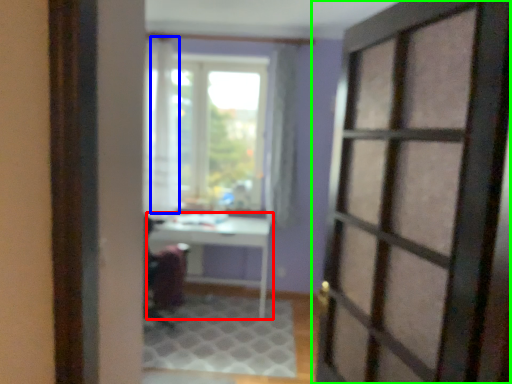
Question: Based on their relative distances, which object is farther from table (highlighted by a red box)? Choose from curtain (highlighted by a blue box) and door (highlighted by a green box).

Choices:
 (A) curtain
 (B) door

Answer: (B)